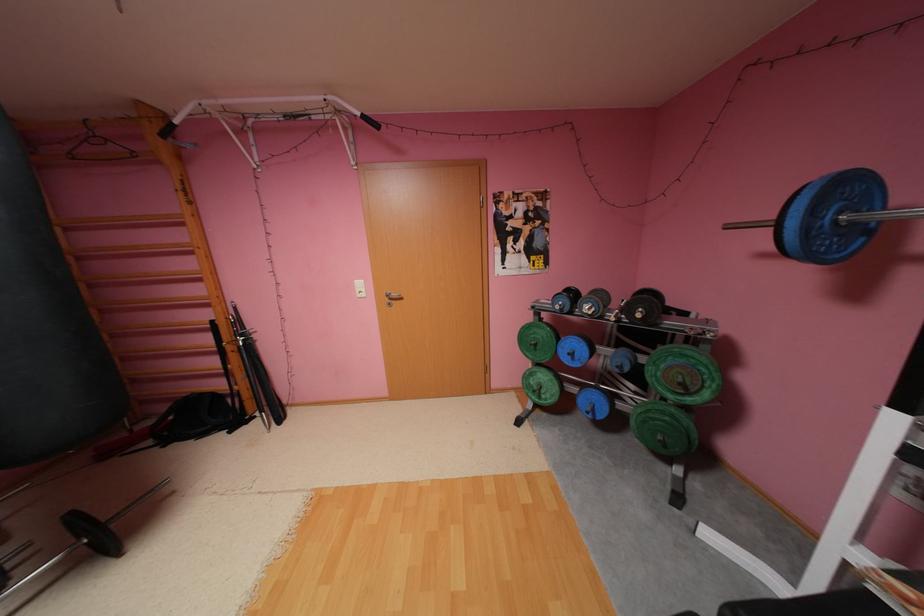
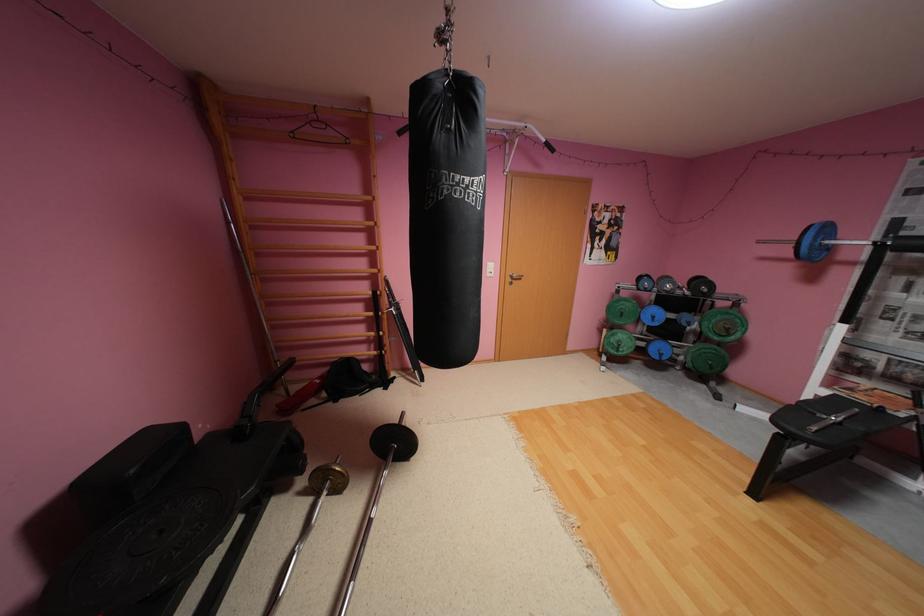
Locate, in the second image, the point that corresponds to point 698,392 in the first image.

(737, 334)